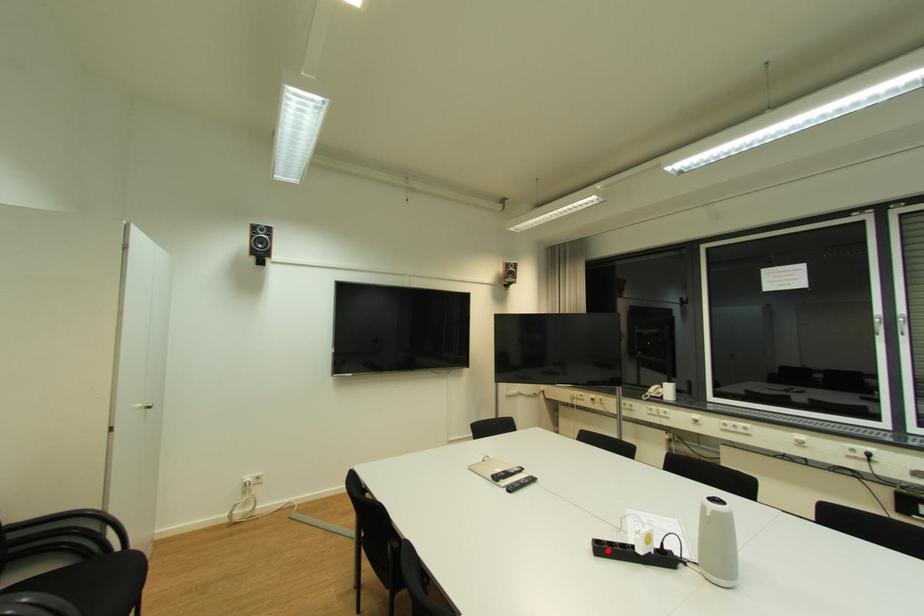
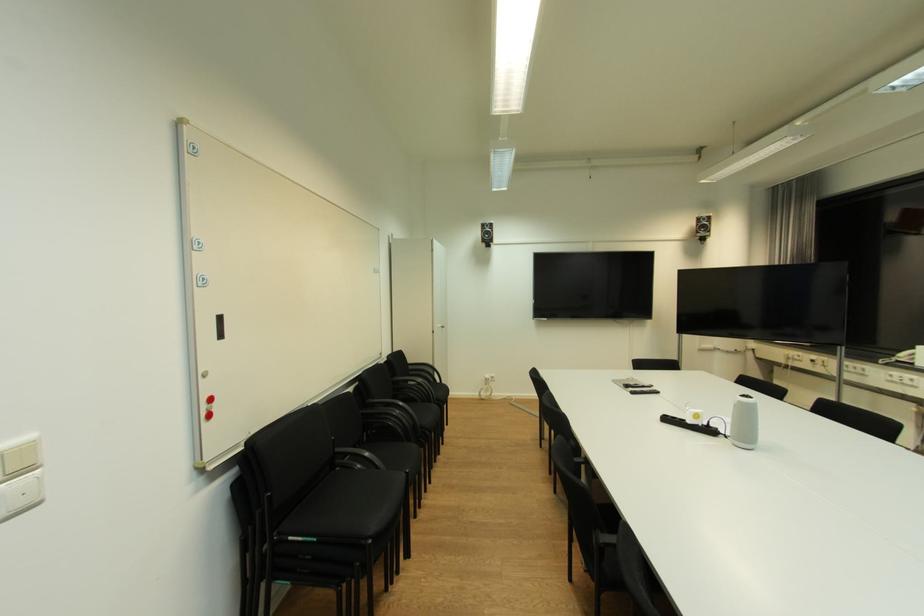
In the second image, find the point that corresponds to the highlighted location in the first image.

(674, 421)